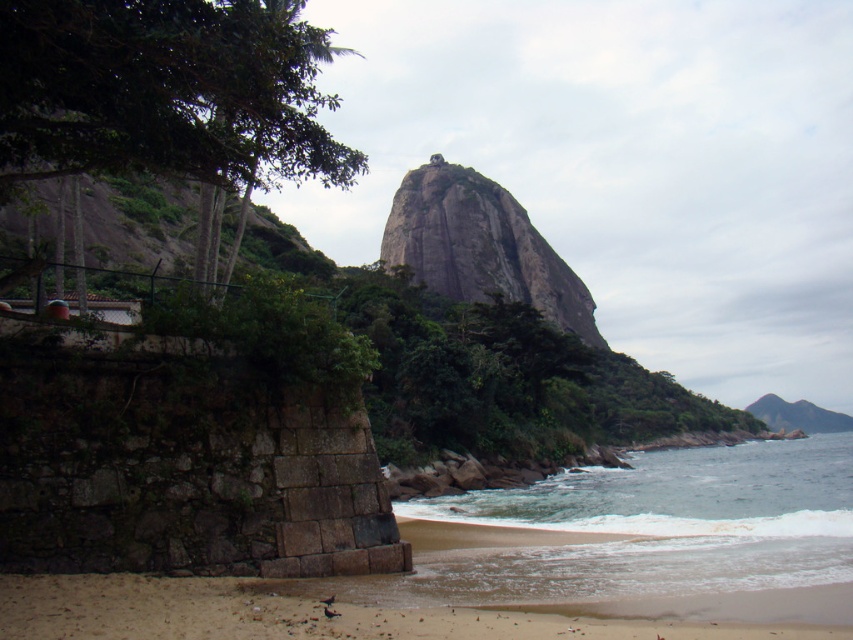
Does white sandy water at lower center appear on the right side of sandy beach at lower left?

Indeed, white sandy water at lower center is positioned on the right side of sandy beach at lower left.

Is white sandy water at lower center above sandy beach at lower left?

No, white sandy water at lower center is not above sandy beach at lower left.

Describe the element at coordinates (660, 534) in the screenshot. I see `white sandy water at lower center` at that location.

At what (x,y) coordinates should I click in order to perform the action: click on white sandy water at lower center. Please return your answer as a coordinate pair (x, y). Looking at the image, I should click on (660, 534).

At what (x,y) coordinates should I click in order to perform the action: click on white sandy water at lower center. Please return your answer as a coordinate pair (x, y). Looking at the image, I should click on (660, 534).

Between point (679, 579) and point (479, 278), which one is positioned behind?

The point (479, 278) is behind.

Is point (492, 595) closer to viewer compared to point (428, 195)?

Yes.

Locate an element on the screen. This screenshot has width=853, height=640. white sandy water at lower center is located at coordinates pos(660,534).

Does sandy beach at lower left have a lesser height compared to gray rock at center?

Correct, sandy beach at lower left is not as tall as gray rock at center.

Who is more distant from viewer, (16, 593) or (444, 216)?

The point (444, 216) is more distant.

Where is `sandy beach at lower left`? The height and width of the screenshot is (640, 853). sandy beach at lower left is located at coordinates (308, 614).